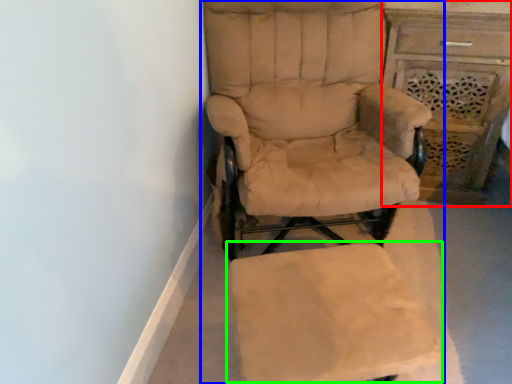
Question: Considering the real-world distances, which object is farthest from vanity (highlighted by a red box)? chair (highlighted by a blue box) or swivel chair (highlighted by a green box)?

Choices:
 (A) chair
 (B) swivel chair

Answer: (B)